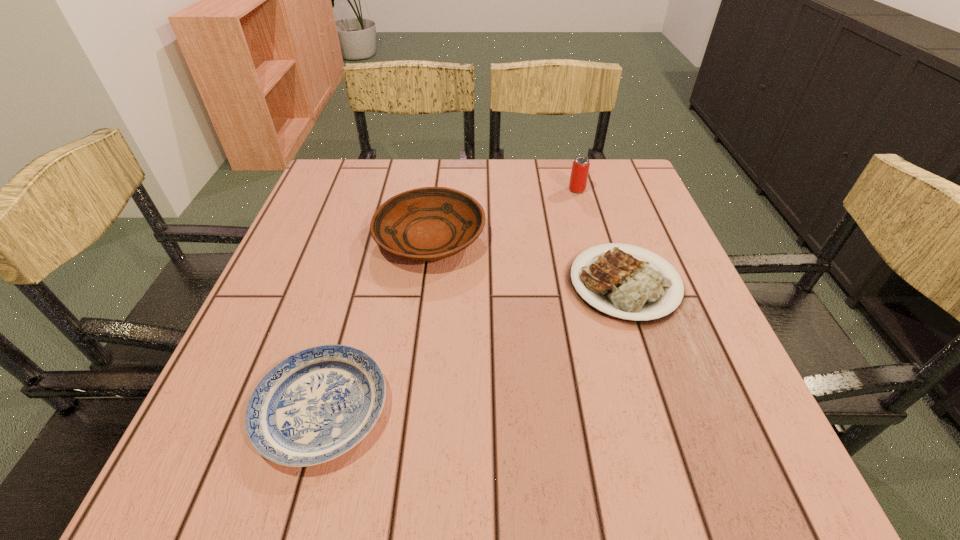
Image resolution: width=960 pixels, height=540 pixels. Identify the location of the farthest object. (580, 169).

Locate an element on the screen. the tallest object is located at coordinates (580, 169).

Identify the location of the tallest plate. The image size is (960, 540). (430, 223).

Identify the location of the rightmost plate. The width and height of the screenshot is (960, 540). (620, 285).

I want to click on the nearest plate, so click(x=317, y=404).

You are a GUI agent. You are given a task and a screenshot of the screen. Output one action in this format:
    pyautogui.click(x=<x>, y=<y>)
    Task: Click on the vacant point located on the left of the beer can
    
    Given the screenshot: What is the action you would take?
    pyautogui.click(x=501, y=190)

You are a GUI agent. You are given a task and a screenshot of the screen. Output one action in this format:
    pyautogui.click(x=<x>, y=<y>)
    Task: Click on the vacant space situated on the left of the tallest plate
    
    Given the screenshot: What is the action you would take?
    pyautogui.click(x=349, y=238)

Where is `vacant area located 0.080m on the left of the rightmost plate`? Image resolution: width=960 pixels, height=540 pixels. vacant area located 0.080m on the left of the rightmost plate is located at coordinates (524, 284).

Image resolution: width=960 pixels, height=540 pixels. Find the location of `free space located 0.360m on the back of the nearest plate`. free space located 0.360m on the back of the nearest plate is located at coordinates (372, 231).

Identify the location of beer can that is positioned at the far edge. This screenshot has height=540, width=960. (580, 169).